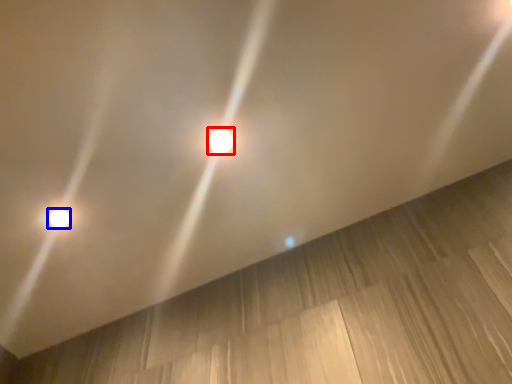
Question: Which point is further to the camera, lamp (highlighted by a red box) or lamp (highlighted by a blue box)?

Choices:
 (A) lamp
 (B) lamp

Answer: (B)